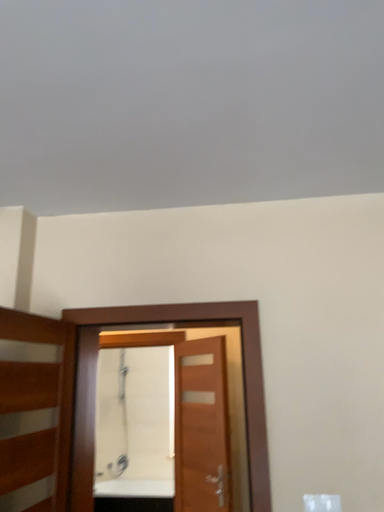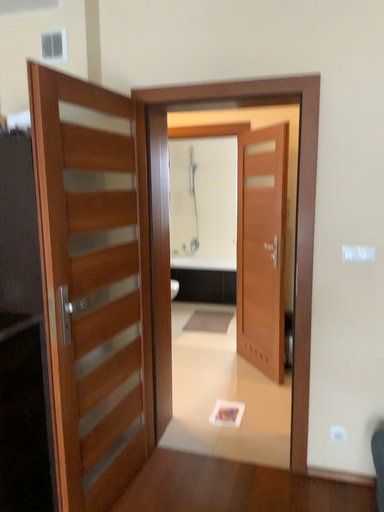
Question: Which way did the camera rotate in the video?

Choices:
 (A) rotated upward
 (B) rotated downward

Answer: (B)